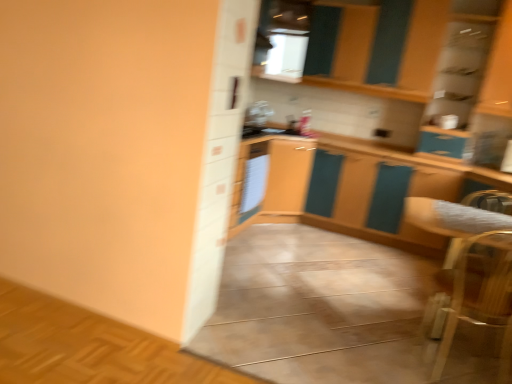
The height and width of the screenshot is (384, 512). Identify the location of wooden armchair at lower right. point(477,294).

The image size is (512, 384). What do you see at coordinates (477, 294) in the screenshot?
I see `wooden armchair at lower right` at bounding box center [477, 294].

Find the location of a particular element. white glossy refrigerator at center is located at coordinates (254, 184).

The height and width of the screenshot is (384, 512). What do you see at coordinates (254, 184) in the screenshot?
I see `white glossy refrigerator at center` at bounding box center [254, 184].

What is the approximate height of white glossy refrigerator at center?

white glossy refrigerator at center is 18.31 inches in height.

In the scene shown: What is the approximate width of white glossy refrigerator at center?

2.08 inches.

Image resolution: width=512 pixels, height=384 pixels. Find the location of `wooden armchair at lower right`. wooden armchair at lower right is located at coordinates (477, 294).

Can you confirm if wooden armchair at lower right is positioned to the right of white glossy refrigerator at center?

Yes.

Which object is more forward, wooden armchair at lower right or white glossy refrigerator at center?

wooden armchair at lower right is closer to the camera.

Which is more distant, (490,294) or (255,183)?

The point (255,183) is behind.

From the image's perspective, which object appears higher, wooden armchair at lower right or white glossy refrigerator at center?

From the image's view, white glossy refrigerator at center is above.

From a real-world perspective, is wooden armchair at lower right positioned above or below white glossy refrigerator at center?

In terms of real-world spatial position, wooden armchair at lower right is below white glossy refrigerator at center.

Considering the sizes of objects wooden armchair at lower right and white glossy refrigerator at center in the image provided, who is thinner, wooden armchair at lower right or white glossy refrigerator at center?

white glossy refrigerator at center is thinner.

In terms of height, does wooden armchair at lower right look taller or shorter compared to white glossy refrigerator at center?

wooden armchair at lower right is taller than white glossy refrigerator at center.

Is wooden armchair at lower right bigger than white glossy refrigerator at center?

Indeed, wooden armchair at lower right has a larger size compared to white glossy refrigerator at center.

Would you say wooden armchair at lower right is inside or outside white glossy refrigerator at center?

wooden armchair at lower right is not inside white glossy refrigerator at center, it's outside.

Is wooden armchair at lower right far away from white glossy refrigerator at center?

Yes, wooden armchair at lower right and white glossy refrigerator at center are located far from each other.

Is wooden armchair at lower right positioned with its back to white glossy refrigerator at center?

No, wooden armchair at lower right is not facing away from white glossy refrigerator at center.

How different are the orientations of wooden armchair at lower right and white glossy refrigerator at center in degrees?

The angle between the facing direction of wooden armchair at lower right and the facing direction of white glossy refrigerator at center is 94.2 degrees.

This screenshot has width=512, height=384. In the image, there is a white glossy refrigerator at center. What are the coordinates of `armchair below it (from the image's perspective)` in the screenshot? It's located at (477, 294).

Which object is positioned more to the right, white glossy refrigerator at center or wooden armchair at lower right?

wooden armchair at lower right.

Is white glossy refrigerator at center positioned behind wooden armchair at lower right?

Yes, white glossy refrigerator at center is further from the camera.

Does point (263, 196) come closer to viewer compared to point (467, 274)?

No, (263, 196) is behind (467, 274).

From the image's perspective, relative to wooden armchair at lower right, is white glossy refrigerator at center above or below?

From the image's perspective, white glossy refrigerator at center appears above wooden armchair at lower right.

From a real-world perspective, which is physically below, white glossy refrigerator at center or wooden armchair at lower right?

From a 3D spatial view, wooden armchair at lower right is below.

Considering the relative sizes of white glossy refrigerator at center and wooden armchair at lower right in the image provided, is white glossy refrigerator at center wider than wooden armchair at lower right?

No.

Which of these two, white glossy refrigerator at center or wooden armchair at lower right, stands shorter?

white glossy refrigerator at center.

Consider the image. Is white glossy refrigerator at center bigger than wooden armchair at lower right?

Actually, white glossy refrigerator at center might be smaller than wooden armchair at lower right.

Would you say white glossy refrigerator at center is outside wooden armchair at lower right?

Yes.

Is white glossy refrigerator at center not close to wooden armchair at lower right?

Yes.

Is white glossy refrigerator at center facing away from wooden armchair at lower right?

That's not correct — white glossy refrigerator at center is not looking away from wooden armchair at lower right.

In the image, there is a white glossy refrigerator at center. Where is `armchair below it (from a real-world perspective)`? armchair below it (from a real-world perspective) is located at coordinates (477, 294).

You are a GUI agent. You are given a task and a screenshot of the screen. Output one action in this format:
    pyautogui.click(x=<x>, y=<y>)
    Task: Click on the armchair on the right of the white glossy refrigerator at center
    
    Given the screenshot: What is the action you would take?
    pyautogui.click(x=477, y=294)

Where is `appliance on the left of the wooden armchair at lower right`? This screenshot has width=512, height=384. appliance on the left of the wooden armchair at lower right is located at coordinates (254, 184).